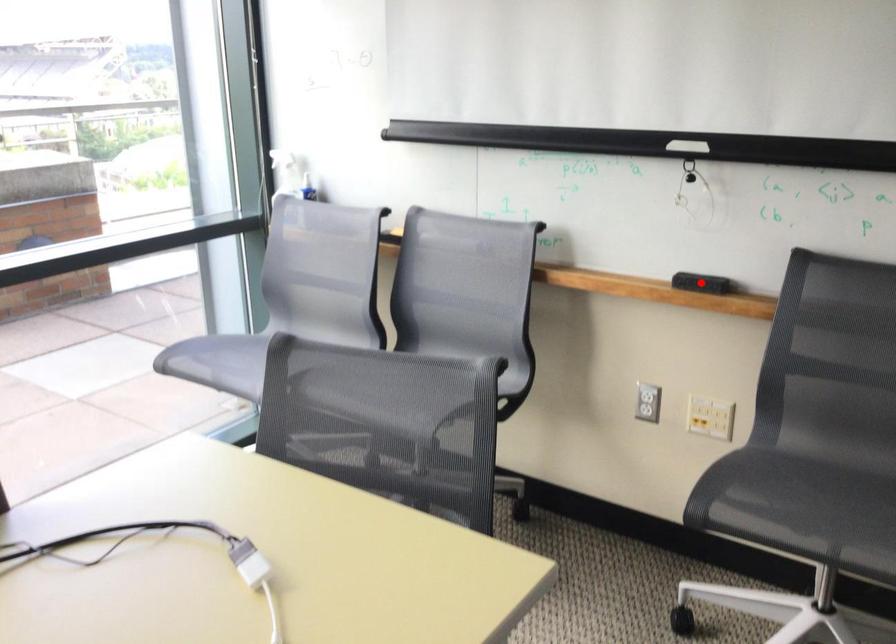
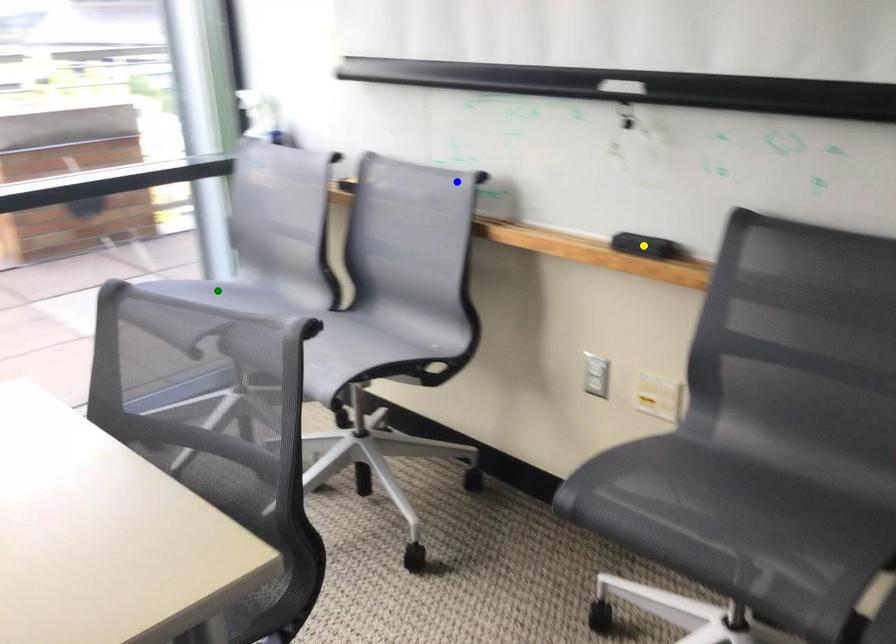
Question: I am providing you with two images of the same scene from different viewpoints. A red point is marked on the first image. You are given multiple points on the second image. In image 2, which mark is for the same physical point as the one in image 1?

Choices:
 (A) blue point
 (B) green point
 (C) yellow point

Answer: (C)